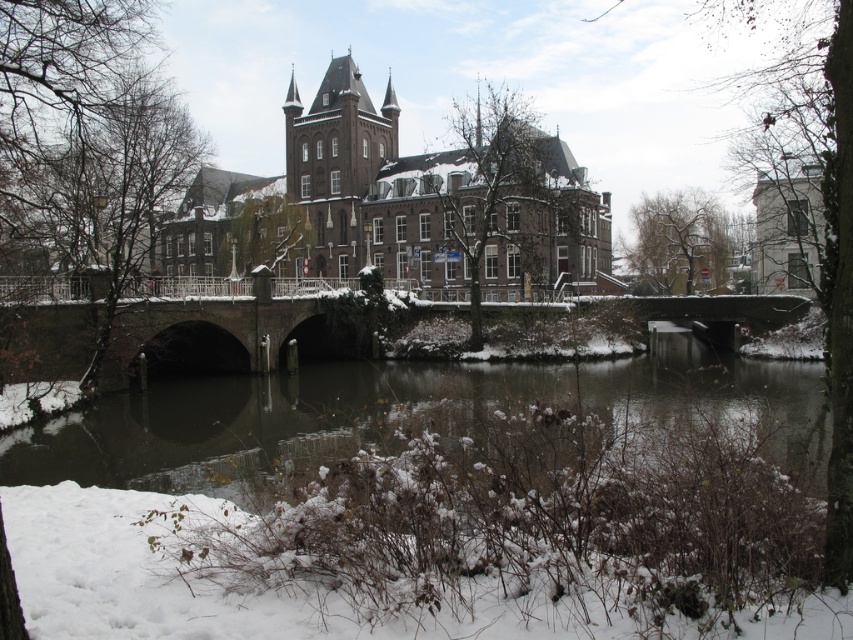
You are standing at the point marked by the coordinates point [389,417] in the winter scene. What do you see around you?

You are standing in snowy brown water at lower center.

You are standing at the point with coordinates point at the center of the image. You see two points, point (39, 346) and point (334, 70). Which point is closer to you?

Point (39, 346) is in front of point (334, 70), so it is closer to you.